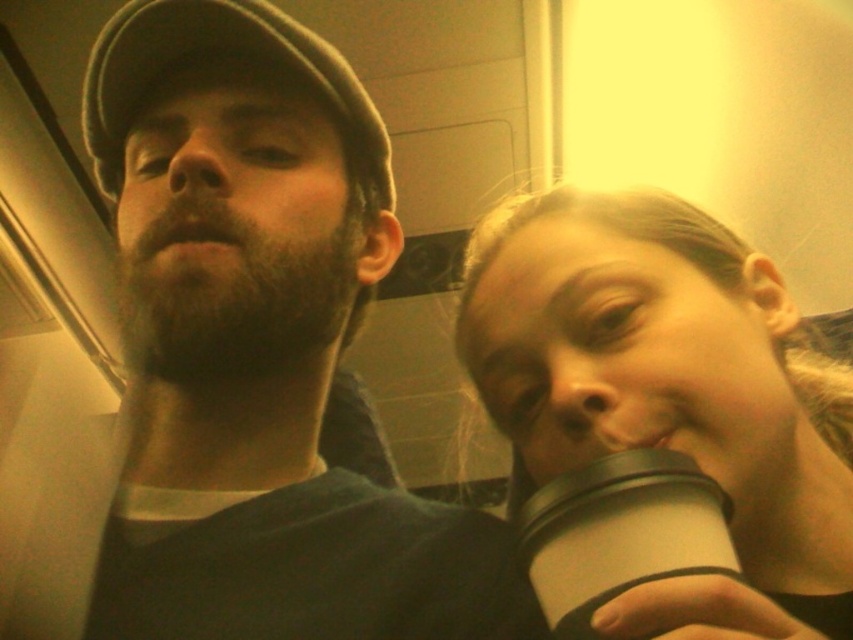
Between point (474, 385) and point (605, 531), which one is positioned in front?

Point (605, 531)

Does white matte cup at right have a lesser height compared to white matte cup at lower right?

No, white matte cup at right is not shorter than white matte cup at lower right.

Is point (576, 349) positioned after point (514, 467)?

No, (576, 349) is in front of (514, 467).

This screenshot has height=640, width=853. In order to click on white matte cup at right in this screenshot , I will do `click(668, 392)`.

Between point (166, 156) and point (675, 572), which one is positioned behind?

The point (166, 156) is more distant.

Looking at this image, who is more forward, (213,163) or (631,486)?

Positioned in front is point (631,486).

This screenshot has width=853, height=640. In order to click on matte black cap at upper left in this screenshot , I will do `click(247, 358)`.

You are a GUI agent. You are given a task and a screenshot of the screen. Output one action in this format:
    pyautogui.click(x=<x>, y=<y>)
    Task: Click on the matte black cap at upper left
    Image resolution: width=853 pixels, height=640 pixels.
    Given the screenshot: What is the action you would take?
    pyautogui.click(x=247, y=358)

Based on the photo, is matte black cap at upper left smaller than white matte cup at right?

Indeed, matte black cap at upper left has a smaller size compared to white matte cup at right.

Which is below, matte black cap at upper left or white matte cup at right?

white matte cup at right is below.

What do you see at coordinates (247, 358) in the screenshot? I see `matte black cap at upper left` at bounding box center [247, 358].

This screenshot has width=853, height=640. Find the location of `matte black cap at upper left`. matte black cap at upper left is located at coordinates (247, 358).